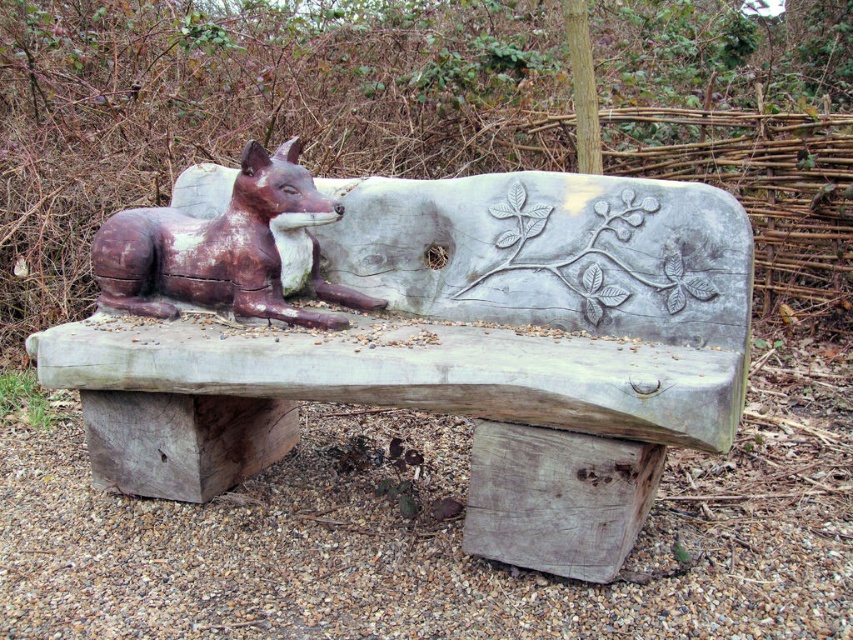
Question: Which object appears closest to the camera in this image?

Choices:
 (A) wooden bench with carved fox at center
 (B) rustic wooden fox at center

Answer: (A)

Question: Can you confirm if wooden bench with carved fox at center is positioned to the right of rustic wooden fox at center?

Choices:
 (A) yes
 (B) no

Answer: (A)

Question: Is wooden bench with carved fox at center wider than rustic wooden fox at center?

Choices:
 (A) no
 (B) yes

Answer: (B)

Question: Where is wooden bench with carved fox at center located in relation to rustic wooden fox at center in the image?

Choices:
 (A) left
 (B) right

Answer: (B)